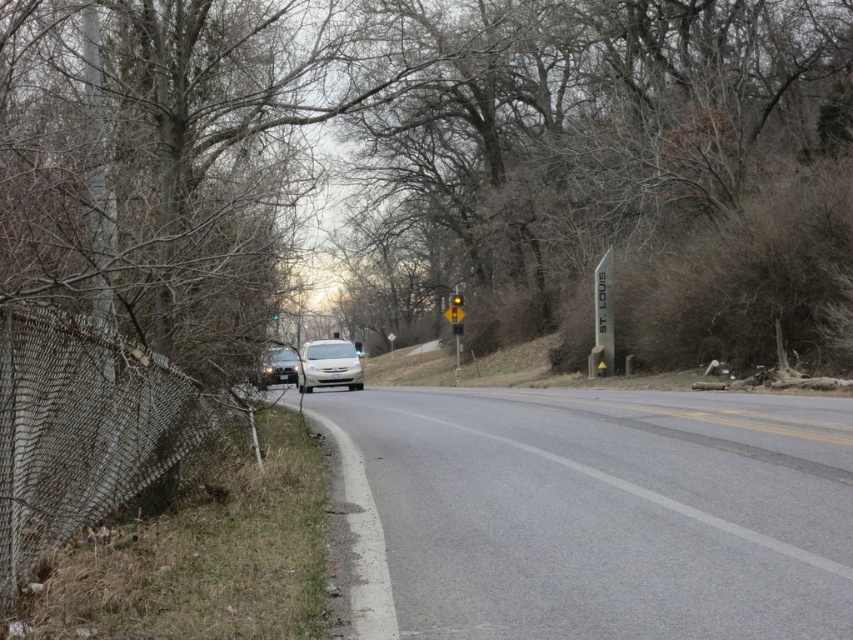
Question: Which point appears farthest from the camera in this image?

Choices:
 (A) (595, 300)
 (B) (494, 561)
 (C) (279, 352)

Answer: (A)

Question: Does brown leafless tree at left come in front of yellow plastic traffic light at center?

Choices:
 (A) yes
 (B) no

Answer: (A)

Question: Which point is farther from the camera taking this photo?

Choices:
 (A) (601, 301)
 (B) (117, 442)
 (C) (315, 344)

Answer: (C)

Question: Considering the relative positions of gray asphalt road at center and rusty mesh fence at left in the image provided, where is gray asphalt road at center located with respect to rusty mesh fence at left?

Choices:
 (A) above
 (B) below

Answer: (B)

Question: Can you confirm if metallic silver sign at center is positioned below satin silver sedan at left?

Choices:
 (A) no
 (B) yes

Answer: (A)

Question: Among these objects, which one is farthest from the camera?

Choices:
 (A) metallic silver sign at center
 (B) satin silver sedan at left
 (C) brown leafless tree at left

Answer: (A)